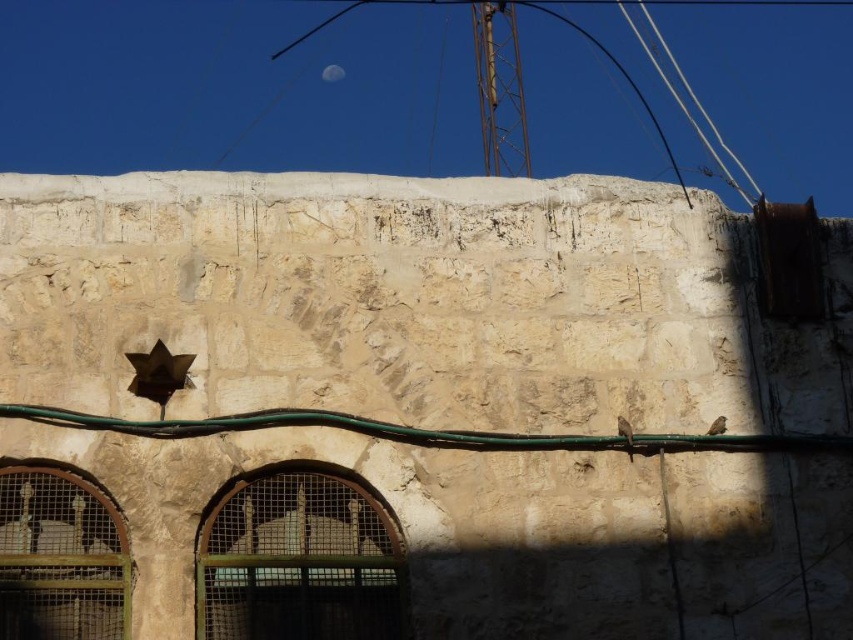
Question: Is green rubber wire at center positioned before white rope at upper center?

Choices:
 (A) yes
 (B) no

Answer: (A)

Question: Does green rubber wire at center have a lesser width compared to white rope at upper center?

Choices:
 (A) no
 (B) yes

Answer: (A)

Question: Does green rubber wire at center lie behind silvery reflective moon at upper center?

Choices:
 (A) no
 (B) yes

Answer: (A)

Question: Which of the following is the closest to the observer?

Choices:
 (A) (640, 435)
 (B) (744, 170)
 (C) (328, 67)

Answer: (A)

Question: Which object is positioned farthest from the silvery reflective moon at upper center?

Choices:
 (A) white rope at upper center
 (B) green rubber wire at center

Answer: (B)

Question: Which point appears farthest from the camera in this image?

Choices:
 (A) (404, 428)
 (B) (323, 77)

Answer: (B)